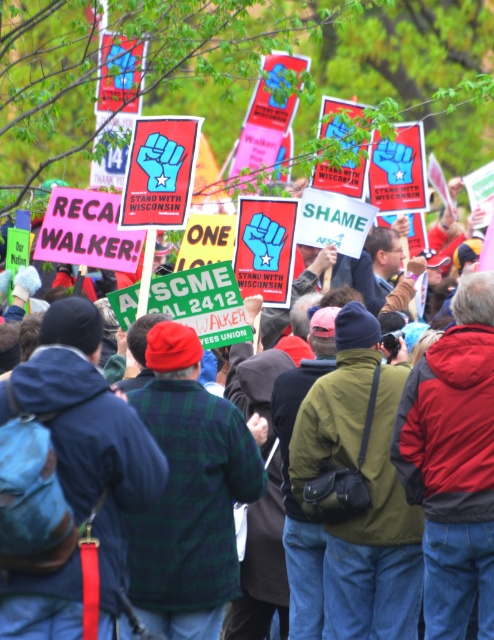
Is red jacket at center positioned behind green fabric jacket at center?

No, it is not.

Between red jacket at center and green fabric jacket at center, which one has more height?

With more height is red jacket at center.

This screenshot has width=494, height=640. Identify the location of red jacket at center. (453, 461).

I want to click on red jacket at center, so [453, 461].

The image size is (494, 640). What do you see at coordinates (453, 461) in the screenshot?
I see `red jacket at center` at bounding box center [453, 461].

The image size is (494, 640). Identify the location of red jacket at center. (453, 461).

Identify the location of red jacket at center. This screenshot has width=494, height=640. (453, 461).

Which is above, green fabric jacket at center or green plaid shirt at center?

Positioned higher is green plaid shirt at center.

Which is behind, point (328, 403) or point (351, 292)?

The point (351, 292) is behind.

Who is more distant from viewer, (380,460) or (353,280)?

The point (353,280) is behind.

What are the coordinates of `green fabric jacket at center` in the screenshot? It's located at (363, 486).